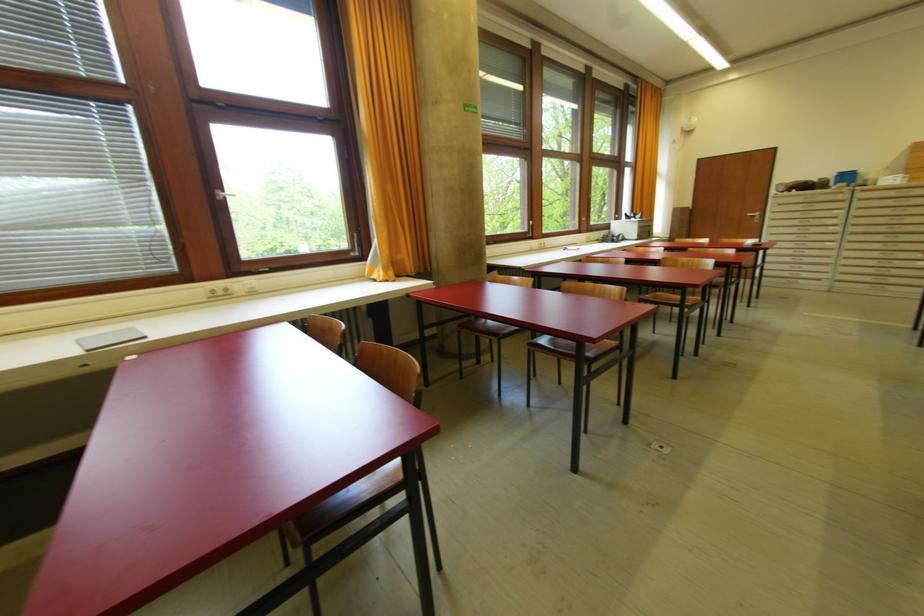
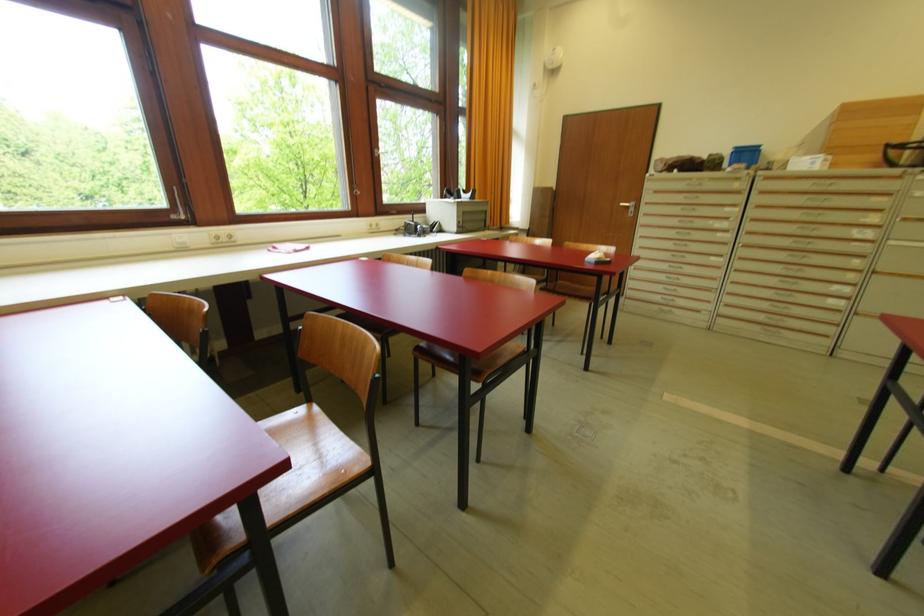
The images are taken continuously from a first-person perspective. In which direction are you moving?

The cameraman moved toward right, forward.